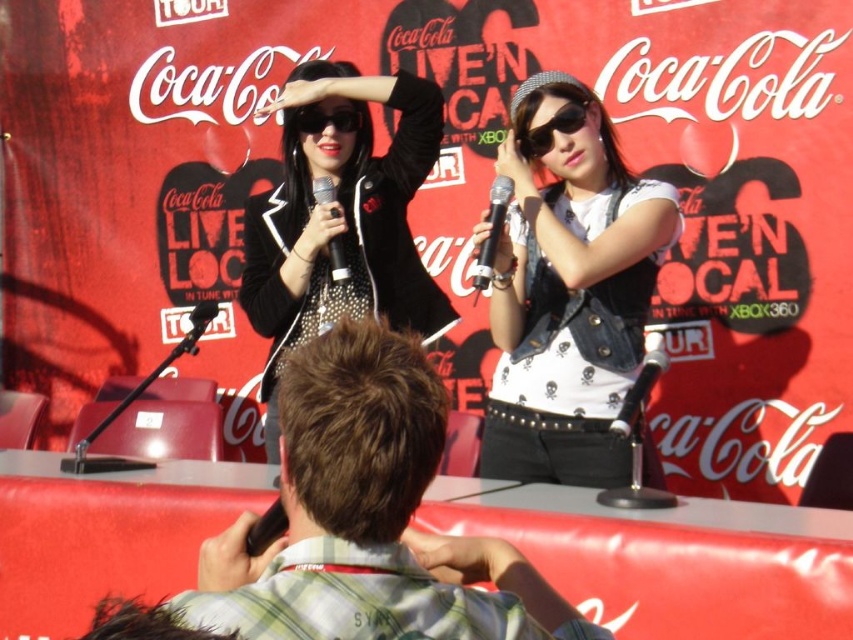
You are standing in the crowd watching the performers. You want to take a photo of the point at coordinates (364,324). If your camera has a minimum focus distance of 2 meters, will it be able to focus on that point?

The distance of point (364,324) from the camera is 2.15 meters, which is greater than the camera minimum focus distance of 2 meters. Therefore, the camera can focus on that point.

You are standing at the center of the stage and want to move towards the point closer to the audience. Which point should you move towards, point [334,372] or point [309,118]?

Point [334,372] is in front of point [309,118], so you should move towards point [334,372] to be closer to the audience.